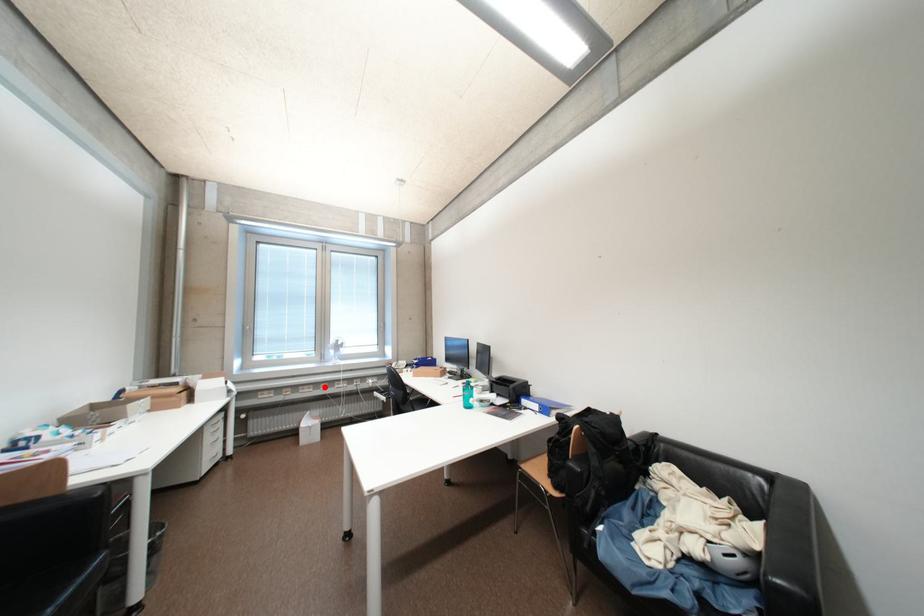
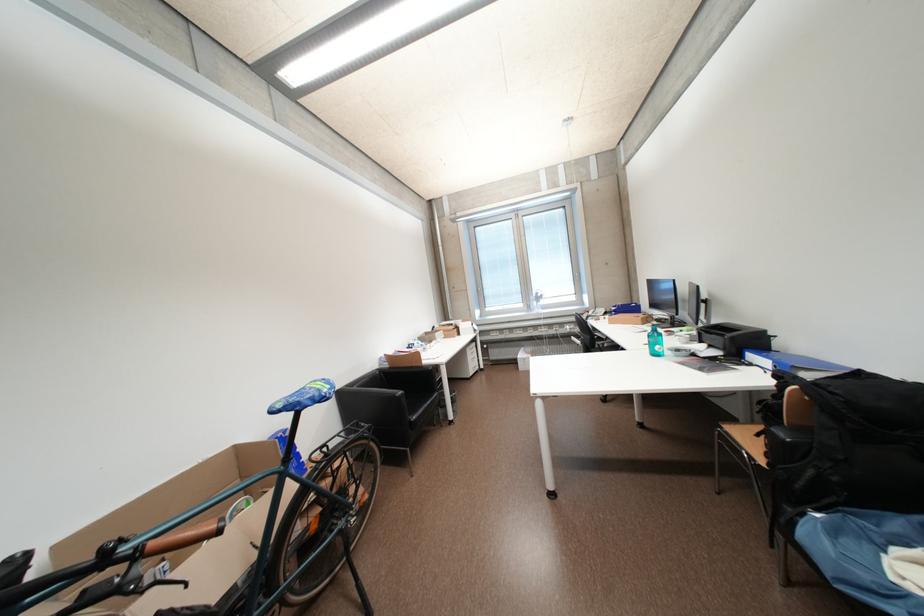
In the second image, find the point that corresponds to the highlighted location in the first image.

(532, 331)